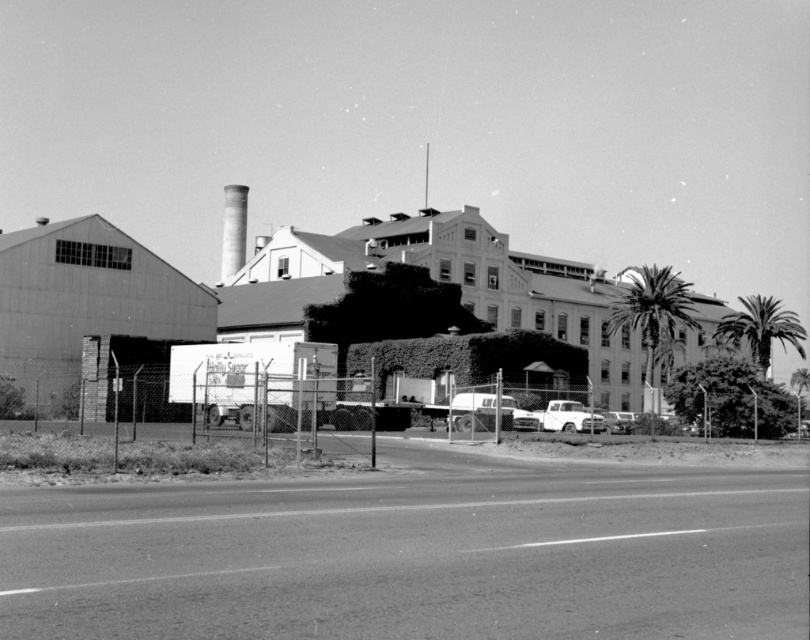
Question: Does dark green leafy palm tree at right have a larger size compared to shiny silver sedan at center?

Choices:
 (A) yes
 (B) no

Answer: (A)

Question: Does shiny silver sedan at center have a greater width compared to shiny chrome pickup truck at center?

Choices:
 (A) no
 (B) yes

Answer: (A)

Question: Which object appears farthest from the camera in this image?

Choices:
 (A) dark green leafy palm tree at right
 (B) green leafy palm tree at center-right
 (C) shiny chrome pickup truck at center
 (D) shiny silver sedan at center

Answer: (A)

Question: Can you confirm if dark green leafy palm tree at right is positioned to the left of shiny chrome pickup truck at center?

Choices:
 (A) yes
 (B) no

Answer: (B)

Question: Which point is closer to the camera taking this photo?

Choices:
 (A) (241, 246)
 (B) (475, 410)

Answer: (B)

Question: Which object is closer to the camera taking this photo?

Choices:
 (A) shiny chrome pickup truck at center
 (B) dark green leafy palm tree at right
 (C) green leafy palm tree at center-right

Answer: (A)